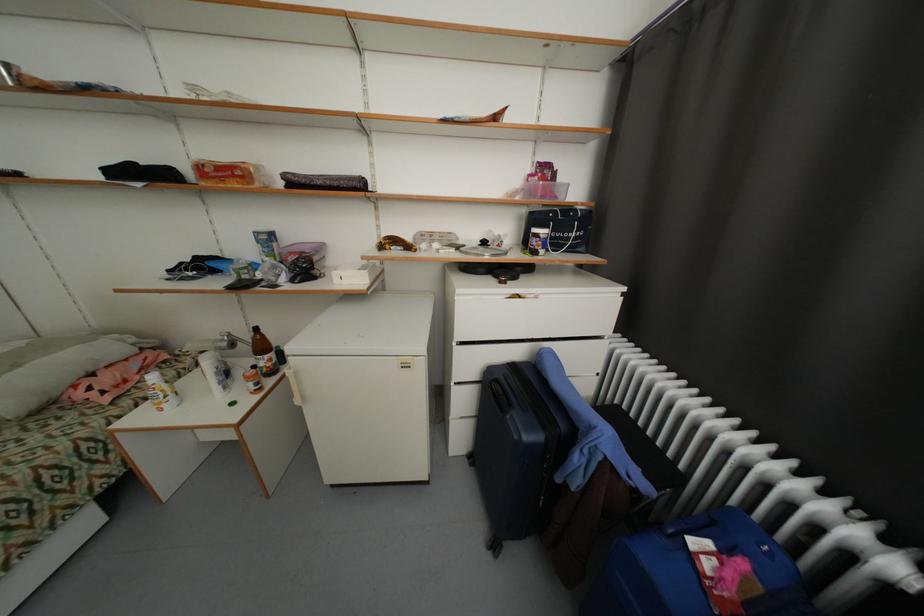
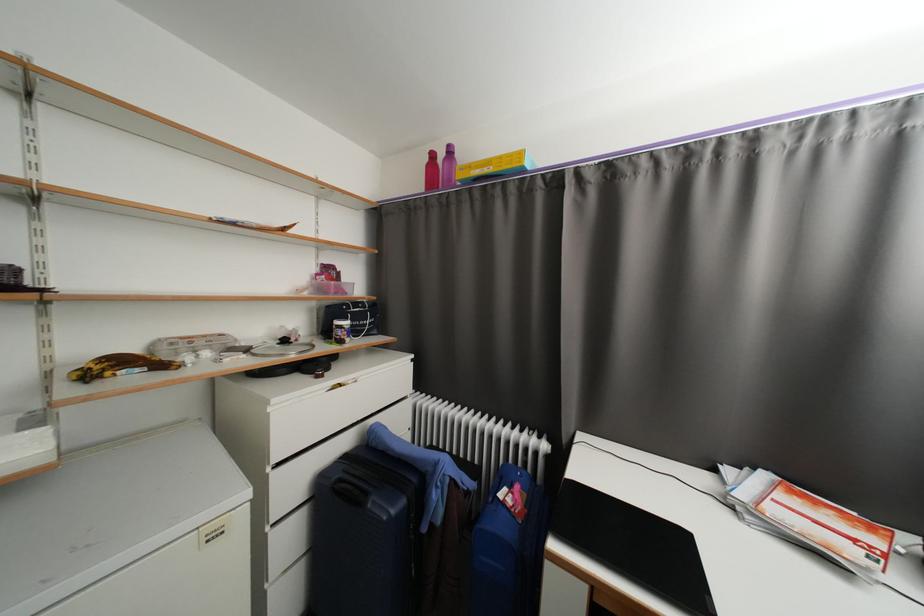
Find the pixel in the second image that matches (550,233) in the first image.

(353, 323)